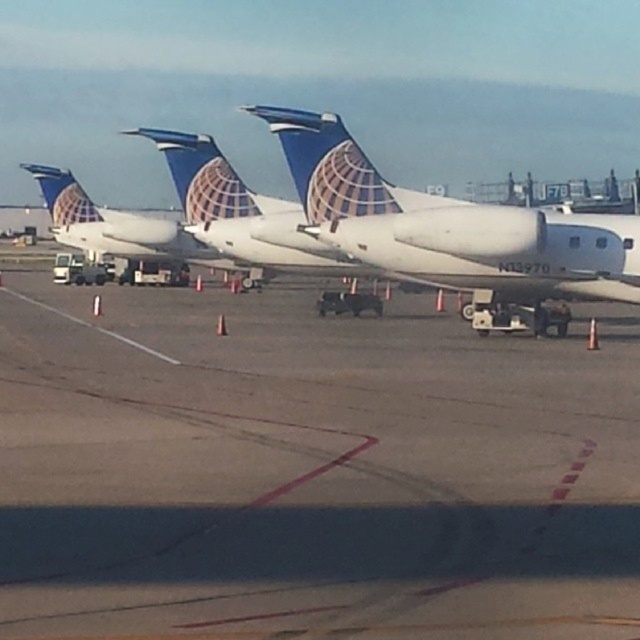
Question: Which point is farther to the camera?

Choices:
 (A) (330, 148)
 (B) (433, 628)

Answer: (A)

Question: Which object appears closest to the camera in this image?

Choices:
 (A) smooth asphalt tarmac at center
 (B) white matte airplane at center

Answer: (A)

Question: Which point is closer to the camera?

Choices:
 (A) (436, 211)
 (B) (80, 624)

Answer: (B)

Question: In this image, where is smooth asphalt tarmac at center located relative to white matte airplane at center?

Choices:
 (A) left
 (B) right

Answer: (B)

Question: Is smooth asphalt tarmac at center to the left of white matte airplane at center from the viewer's perspective?

Choices:
 (A) no
 (B) yes

Answer: (A)

Question: Is smooth asphalt tarmac at center thinner than white matte airplane at center?

Choices:
 (A) no
 (B) yes

Answer: (B)